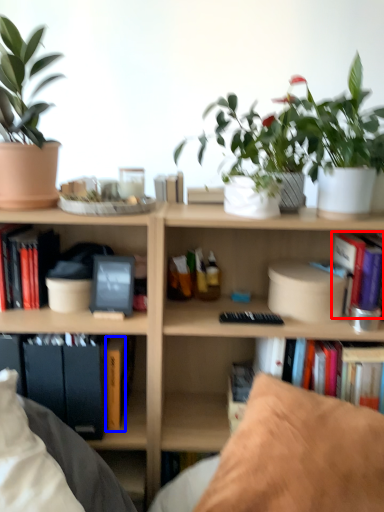
Question: Which of the following is the closest to the observer, book (highlighted by a red box) or paperback book (highlighted by a blue box)?

Choices:
 (A) book
 (B) paperback book

Answer: (A)